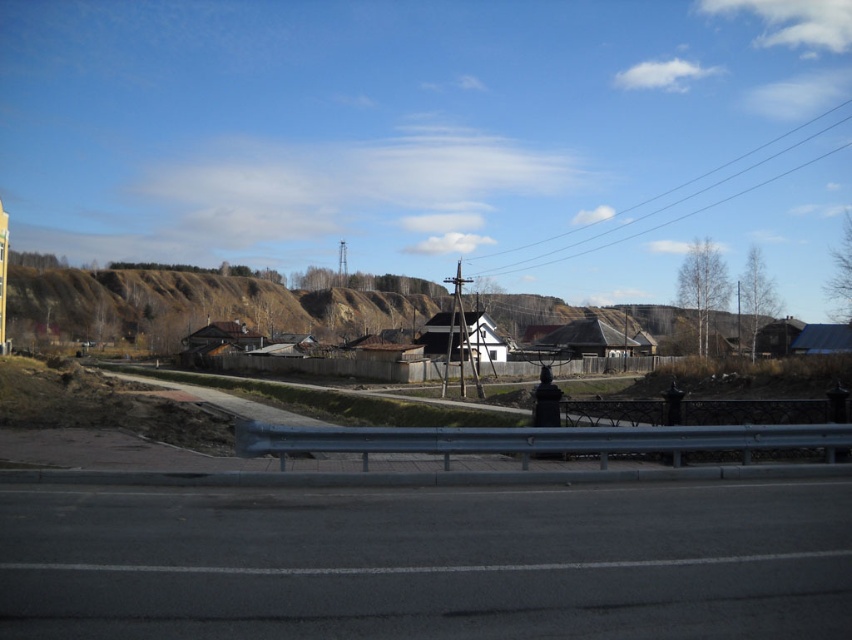
You are a drone operator tasked with capturing aerial footage of the black asphalt highway at lower center and the black wire at upper center. Your drone has a maximum flight range of 150 meters. Can your drone safely capture footage of both objects without needing to recharge or return to base?

The black asphalt highway at lower center and black wire at upper center are 167.85 meters apart. Since the distance between them exceeds the drone maximum flight range of 150 meters, the drone cannot safely capture footage of both objects without needing to recharge or return to base.

You are a delivery driver navigating a rural area and need to make a turn onto a side road. You see a point marked at coordinates point (429,563) on the black asphalt highway at lower center. Is this point located on the road you should take to turn?

The point (429,563) is on the black asphalt highway at lower center, so yes, this point is on the road you should take to turn.